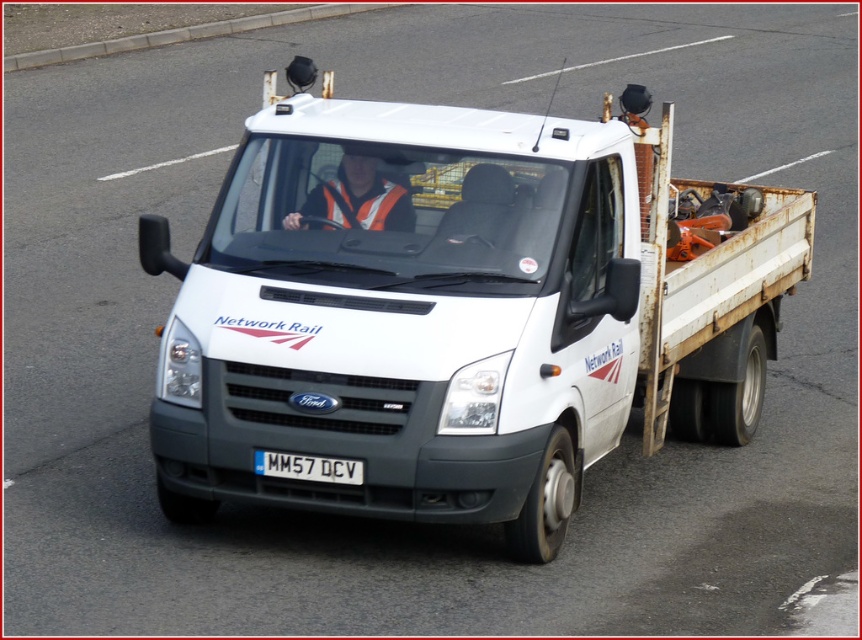
Question: Which point is farther to the camera?

Choices:
 (A) reflective orange vest at center
 (B) white plastic license plate at center
 (C) white matte truck at center

Answer: (A)

Question: Is reflective orange vest at center in front of white plastic license plate at center?

Choices:
 (A) yes
 (B) no

Answer: (B)

Question: Which object is farther from the camera taking this photo?

Choices:
 (A) white matte truck at center
 (B) white plastic license plate at center
 (C) reflective orange vest at center

Answer: (C)

Question: Does white matte truck at center appear on the right side of white plastic license plate at center?

Choices:
 (A) yes
 (B) no

Answer: (A)

Question: Is white matte truck at center closer to the viewer compared to white plastic license plate at center?

Choices:
 (A) yes
 (B) no

Answer: (A)

Question: Estimate the real-world distances between objects in this image. Which object is farther from the white matte truck at center?

Choices:
 (A) reflective orange vest at center
 (B) white plastic license plate at center

Answer: (B)